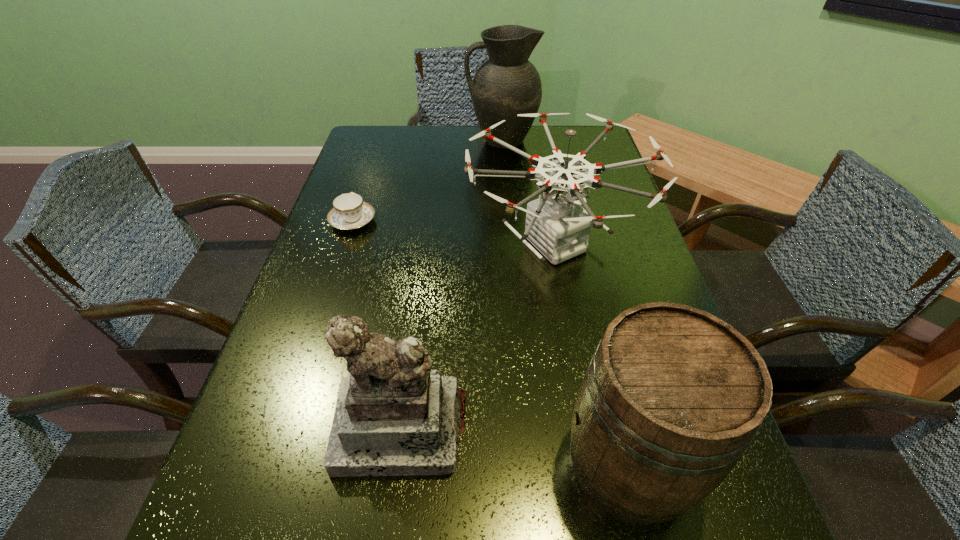
Where is `vacant area located on the front-facing side of the figurine`? vacant area located on the front-facing side of the figurine is located at coordinates coord(390,514).

Locate an element on the screen. free space located on the side of the cider near the bung hole is located at coordinates (477, 464).

I want to click on vacant region located 0.230m on the side of the cider near the bung hole, so click(x=413, y=464).

What are the coordinates of `vacant region located 0.370m on the side of the cider near the bung hole` in the screenshot? It's located at (323, 464).

Where is `free space located 0.130m on the side with the handle of the leftmost object`? The width and height of the screenshot is (960, 540). free space located 0.130m on the side with the handle of the leftmost object is located at coordinates (367, 180).

Where is `vacant space located 0.220m on the side with the handle of the leftmost object`? This screenshot has height=540, width=960. vacant space located 0.220m on the side with the handle of the leftmost object is located at coordinates (372, 164).

The width and height of the screenshot is (960, 540). What are the coordinates of `vacant space situated on the side with the handle of the leftmost object` in the screenshot? It's located at (378, 145).

The height and width of the screenshot is (540, 960). In order to click on object located in the far edge section of the desktop in this screenshot , I will do (506, 84).

Locate an element on the screen. figurine positioned at the left edge is located at coordinates (394, 416).

You are a GUI agent. You are given a task and a screenshot of the screen. Output one action in this format:
    pyautogui.click(x=<x>, y=<y>)
    Task: Click on the teacup that is positioned at the left edge
    The width and height of the screenshot is (960, 540).
    Given the screenshot: What is the action you would take?
    pyautogui.click(x=349, y=212)